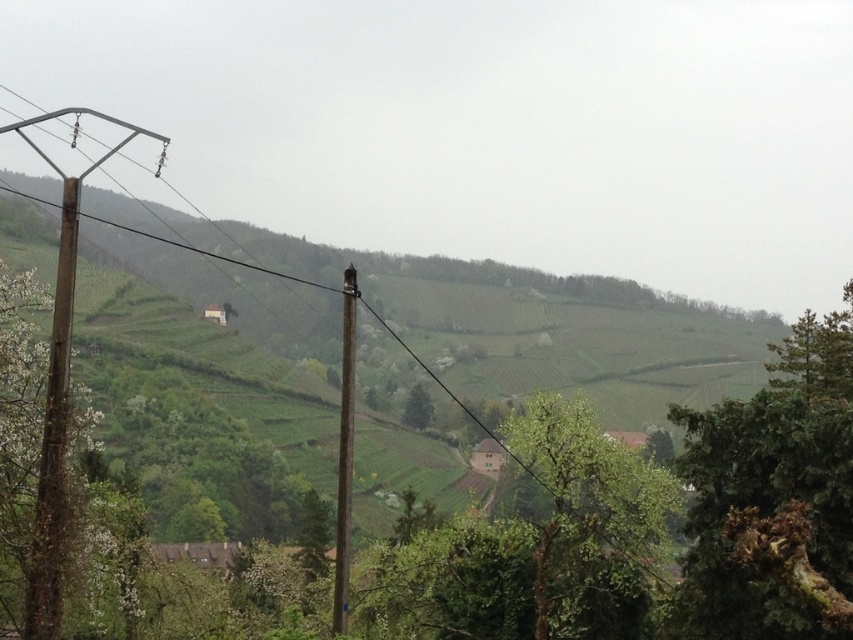
You are a hiker standing at the base of the green leafy tree at upper right and want to reach the brown wooden telegraph pole at center. Which direction should you move to get closer to the pole?

The green leafy tree at upper right is above the brown wooden telegraph pole at center, so to reach the pole, you should move downward from the tree.

Consider the image. You are an observer standing in the middle of the terraced fields. You notice the green leafy tree at upper right and the brown wooden telegraph pole at center. Which object appears closer to you based on their positions in the image?

The green leafy tree at upper right appears closer because it is positioned in front of the brown wooden telegraph pole at center, partially obscuring it from view.

You are standing in a rural landscape with a brown wooden telegraph pole at center. You want to place a 20 meter long banner horizontally between the pole and the nearest building. Is the distance sufficient?

The brown wooden telegraph pole at center is 18.99 meters from viewer. Since the banner is 20 meters long, the distance between the pole and the nearest building is insufficient to accommodate the banner.